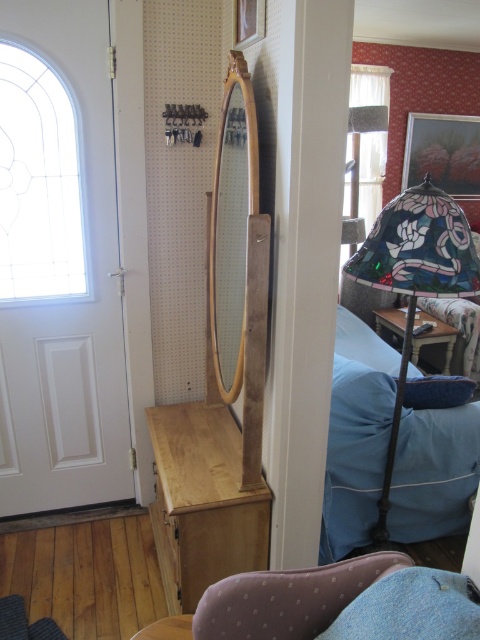
Question: Is the position of clear glass window at upper left less distant than that of blue fabric pillow at right?

Choices:
 (A) no
 (B) yes

Answer: (B)

Question: Which object is farther from the camera taking this photo?

Choices:
 (A) wooden stool at lower center
 (B) blue fabric pillow at right
 (C) wooden mirror at center
 (D) blue fabric pillow at lower right

Answer: (A)

Question: Can you confirm if stained glass lampshade at right is thinner than blue fabric pillow at right?

Choices:
 (A) no
 (B) yes

Answer: (B)

Question: Which of the following is the farthest from the observer?

Choices:
 (A) stained glass lampshade at right
 (B) clear glass window at upper left
 (C) blue fabric pillow at right
 (D) blue fabric pillow at lower right

Answer: (C)

Question: Which object is farther from the camera taking this photo?

Choices:
 (A) clear glass window at upper left
 (B) blue fabric pillow at right
 (C) stained glass lampshade at right

Answer: (B)

Question: Is clear glass window at upper left above blue fabric pillow at lower right?

Choices:
 (A) no
 (B) yes

Answer: (B)